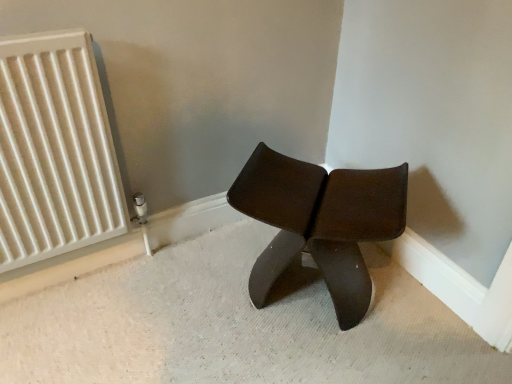
Find the location of a particular element. The image size is (512, 384). vacant area situated below matte brown stool at center (from a real-world perspective) is located at coordinates pos(301,293).